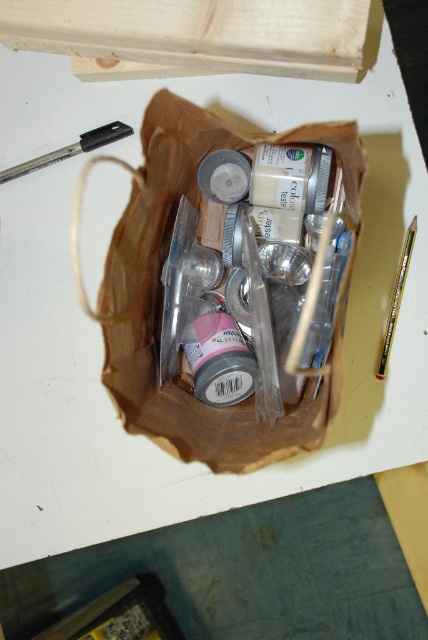
Is brown paper bag at center above metallic silver paint brush at right?

Correct, brown paper bag at center is located above metallic silver paint brush at right.

Who is positioned more to the right, brown paper bag at center or metallic silver paint brush at right?

metallic silver paint brush at right is more to the right.

Find the location of a particular element. This screenshot has height=640, width=428. brown paper bag at center is located at coordinates (160, 291).

Who is more forward, (187, 353) or (51, 161)?

Point (187, 353)

Between matte pink plastic bottle at center and metallic pen at upper left, which one is positioned higher?

metallic pen at upper left is above.

Identify the location of matte pink plastic bottle at center. The height and width of the screenshot is (640, 428). click(217, 355).

Which is above, brown paper bag at center or metallic pen at upper left?

metallic pen at upper left

Who is more forward, (303, 435) or (56, 157)?

Point (303, 435) is more forward.

Locate an element on the screen. This screenshot has width=428, height=640. brown paper bag at center is located at coordinates (160, 291).